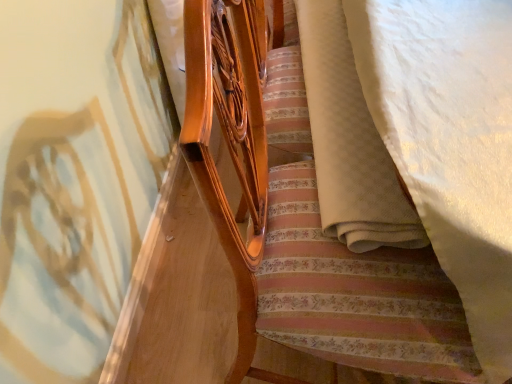
You are a GUI agent. You are given a task and a screenshot of the screen. Output one action in this format:
    pyautogui.click(x=<x>, y=<y>)
    Task: Click on the blank space situated above white textured blanket at lower right (from a real-world perspective)
    
    Given the screenshot: What is the action you would take?
    pyautogui.click(x=337, y=91)